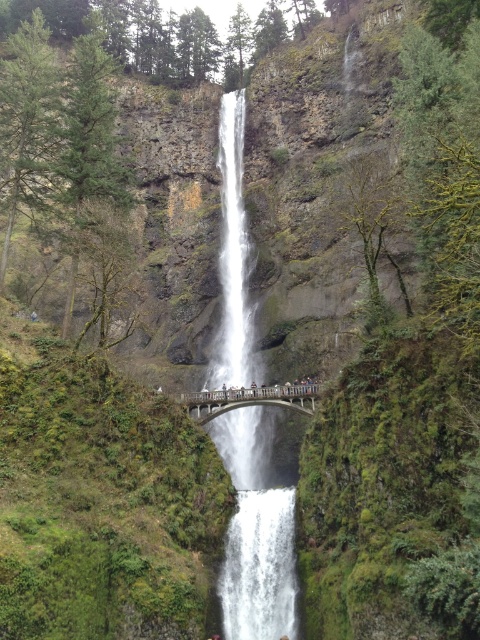
Is wooden bridge at center thinner than smooth gray bridge at center?

No, wooden bridge at center is not thinner than smooth gray bridge at center.

I want to click on wooden bridge at center, so click(251, 400).

At what (x,y) coordinates should I click in order to perform the action: click on wooden bridge at center. Please return your answer as a coordinate pair (x, y). Looking at the image, I should click on (251, 400).

Does smooth concrete bridge at center have a greater height compared to smooth gray bridge at center?

No.

Does smooth concrete bridge at center have a lesser width compared to smooth gray bridge at center?

Correct, smooth concrete bridge at center's width is less than smooth gray bridge at center's.

Who is more forward, (252, 381) or (227, 388)?

Positioned in front is point (227, 388).

The image size is (480, 640). In order to click on smooth concrete bridge at center in this screenshot , I will do `click(252, 388)`.

Is white smooth waterfall at center above light brown wooden bridge at center?

Yes, white smooth waterfall at center is above light brown wooden bridge at center.

Which is above, white smooth waterfall at center or light brown wooden bridge at center?

white smooth waterfall at center is above.

Which is in front, point (249, 452) or point (31, 316)?

Point (31, 316) is in front.

Find the location of `white smooth waterfall at center`. white smooth waterfall at center is located at coordinates (254, 532).